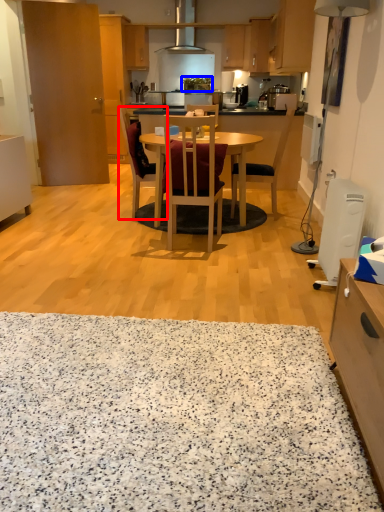
Question: Which object is further to the camera taking this photo, chair (highlighted by a red box) or pot/pan (highlighted by a blue box)?

Choices:
 (A) chair
 (B) pot/pan

Answer: (B)